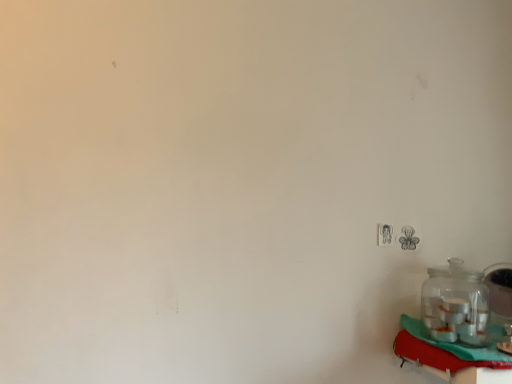
Question: Considering the relative sizes of clear glass jar at right and red fabric table at lower right in the image provided, is clear glass jar at right thinner than red fabric table at lower right?

Choices:
 (A) yes
 (B) no

Answer: (A)

Question: Is clear glass jar at right facing towards red fabric table at lower right?

Choices:
 (A) yes
 (B) no

Answer: (B)

Question: Is clear glass jar at right wider than red fabric table at lower right?

Choices:
 (A) yes
 (B) no

Answer: (B)

Question: From a real-world perspective, does clear glass jar at right sit lower than red fabric table at lower right?

Choices:
 (A) no
 (B) yes

Answer: (A)

Question: Is clear glass jar at right bigger than red fabric table at lower right?

Choices:
 (A) yes
 (B) no

Answer: (B)

Question: Is red fabric table at lower right inside clear glass jar at right?

Choices:
 (A) no
 (B) yes

Answer: (A)

Question: From the image's perspective, is red fabric table at lower right on top of clear glass jar at right?

Choices:
 (A) yes
 (B) no

Answer: (B)

Question: Does red fabric table at lower right come behind clear glass jar at right?

Choices:
 (A) yes
 (B) no

Answer: (B)

Question: Considering the relative positions of red fabric table at lower right and clear glass jar at right in the image provided, is red fabric table at lower right to the left of clear glass jar at right from the viewer's perspective?

Choices:
 (A) no
 (B) yes

Answer: (A)

Question: Does red fabric table at lower right turn towards clear glass jar at right?

Choices:
 (A) yes
 (B) no

Answer: (B)

Question: From a real-world perspective, is red fabric table at lower right physically below clear glass jar at right?

Choices:
 (A) yes
 (B) no

Answer: (A)

Question: Is red fabric table at lower right not inside clear glass jar at right?

Choices:
 (A) yes
 (B) no

Answer: (A)

Question: In terms of width, does red fabric table at lower right look wider or thinner when compared to clear glass jar at right?

Choices:
 (A) thin
 (B) wide

Answer: (B)